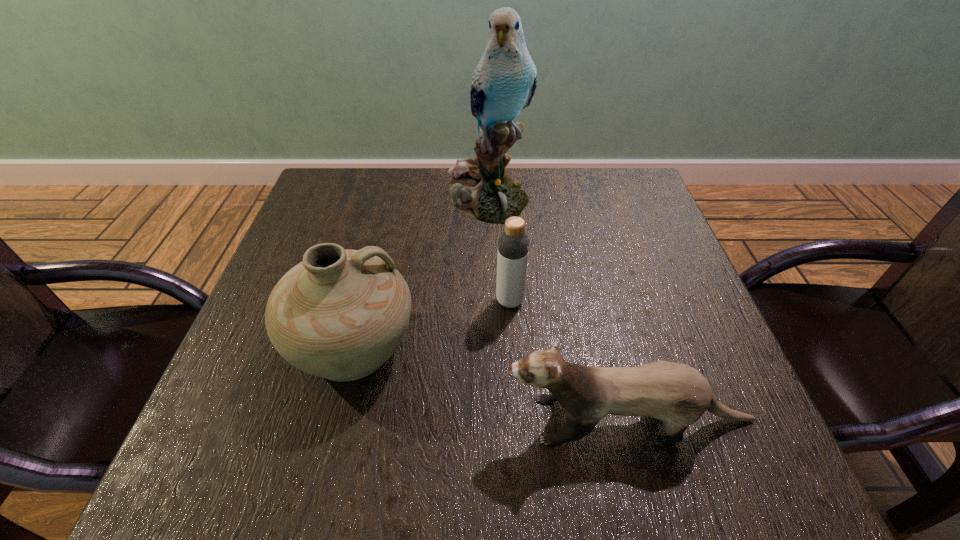
At what (x,y) coordinates should I click in order to perform the action: click on parakeet. Please return your answer as a coordinate pair (x, y). Looking at the image, I should click on (504, 81).

Where is `the farthest object`? The width and height of the screenshot is (960, 540). the farthest object is located at coordinates (504, 81).

This screenshot has height=540, width=960. I want to click on the leftmost object, so click(340, 314).

The width and height of the screenshot is (960, 540). I want to click on bottle, so click(x=513, y=244).

Where is `ferret`? The height and width of the screenshot is (540, 960). ferret is located at coordinates (677, 394).

The image size is (960, 540). Find the location of `vacant position located on the face of the tallest object`. vacant position located on the face of the tallest object is located at coordinates (490, 300).

Find the location of a particular element. This screenshot has height=540, width=960. vacant space located on the right of the leftmost object is located at coordinates (610, 346).

The width and height of the screenshot is (960, 540). Identify the location of vacant space located 0.390m on the back of the bottle. 502,186.

Where is `vacant space located 0.380m on the face of the shortest object`? The height and width of the screenshot is (540, 960). vacant space located 0.380m on the face of the shortest object is located at coordinates (274, 420).

At what (x,y) coordinates should I click in order to perform the action: click on free space located 0.230m on the face of the shortest object. Please return your answer as a coordinate pair (x, y). This screenshot has width=960, height=540. Looking at the image, I should click on (365, 420).